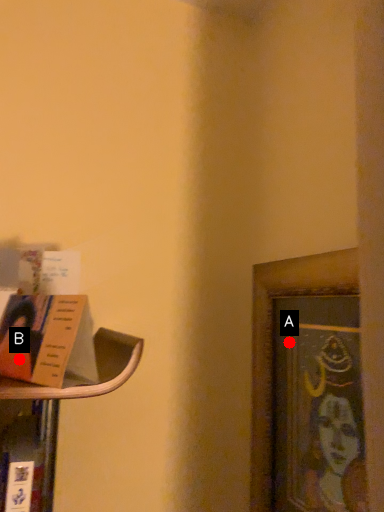
Question: Two points are circled on the image, labeled by A and B beside each circle. Which point is closer to the camera?

Choices:
 (A) A is closer
 (B) B is closer

Answer: (B)